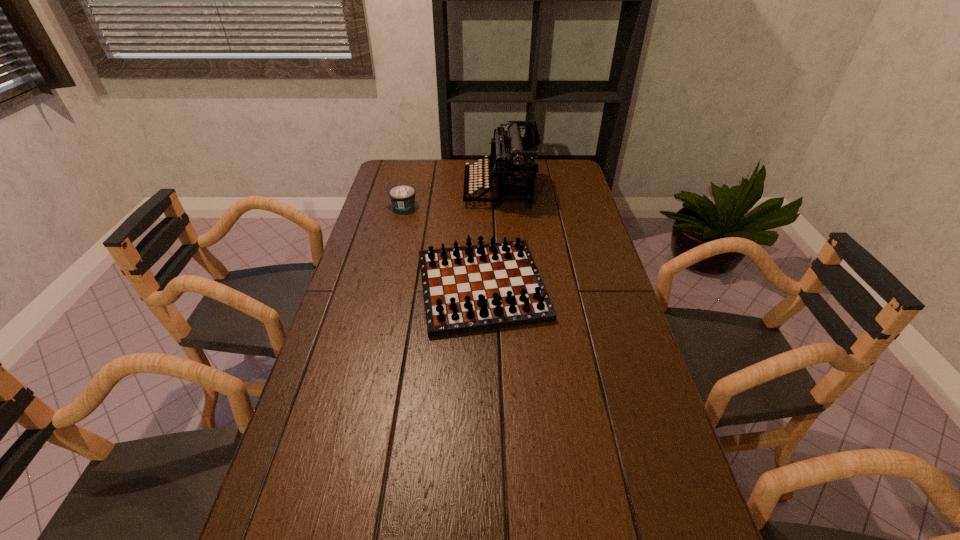
You are a GUI agent. You are given a task and a screenshot of the screen. Output one action in this format:
    pyautogui.click(x=<x>, y=<y>)
    Task: Click on the vacant space that is in between the yogurt and the second shortest object
    Image resolution: width=960 pixels, height=540 pixels.
    Given the screenshot: What is the action you would take?
    pyautogui.click(x=442, y=246)

Select which object appears as the second closest to the leftmost object. Please provide its 2D coordinates. Your answer should be formatted as a tuple, i.e. [(x, y)], where the tuple contains the x and y coordinates of a point satisfying the conditions above.

[(481, 287)]

Where is `the closest object to the yogurt`? the closest object to the yogurt is located at coordinates (512, 162).

Find the location of `free space in the image that satisfies the following two spatial constraints: 1. on the typing side of the tallest object; 2. on the front side of the second tallest object`. free space in the image that satisfies the following two spatial constraints: 1. on the typing side of the tallest object; 2. on the front side of the second tallest object is located at coordinates (505, 286).

At what (x,y) coordinates should I click in order to perform the action: click on free location that satisfies the following two spatial constraints: 1. on the typing side of the typewriter; 2. on the front side of the shortest object. Please return your answer as a coordinate pair (x, y). Image resolution: width=960 pixels, height=540 pixels. Looking at the image, I should click on tap(499, 206).